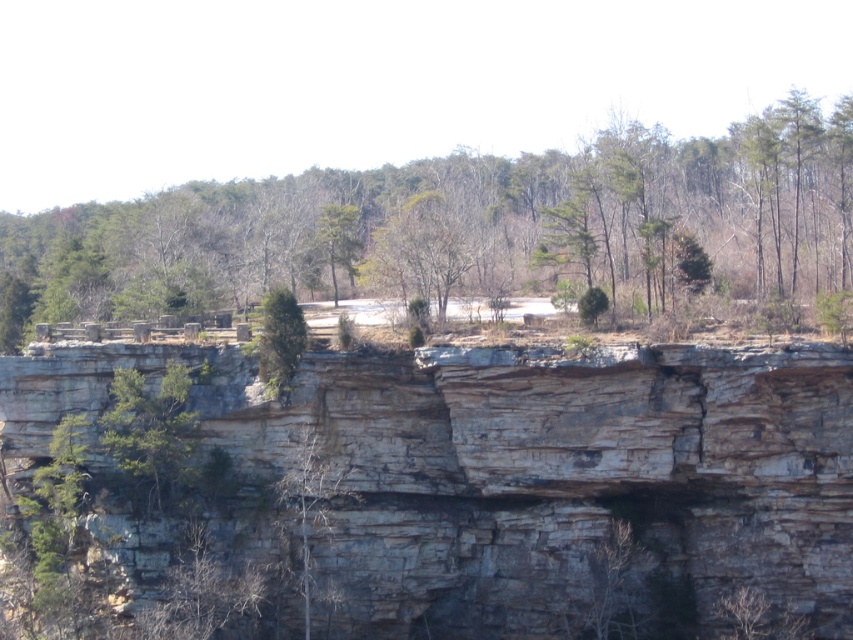
Question: Is gray rock cliff at center bigger than green leafy tree at left?

Choices:
 (A) yes
 (B) no

Answer: (A)

Question: Is gray rock cliff at center wider than green textured tree at center?

Choices:
 (A) no
 (B) yes

Answer: (B)

Question: Estimate the real-world distances between objects in this image. Which object is closer to the gray rock cliff at center?

Choices:
 (A) green leafy tree at left
 (B) green textured tree at center
 (C) green leafy tree at center

Answer: (B)

Question: Which point is closer to the camera?

Choices:
 (A) green textured tree at center
 (B) green leafy tree at center
 (C) gray rock cliff at center

Answer: (C)

Question: Is gray rock cliff at center wider than green leafy tree at left?

Choices:
 (A) no
 (B) yes

Answer: (B)

Question: Among these points, which one is farthest from the camera?

Choices:
 (A) (287, 348)
 (B) (843, 352)

Answer: (A)